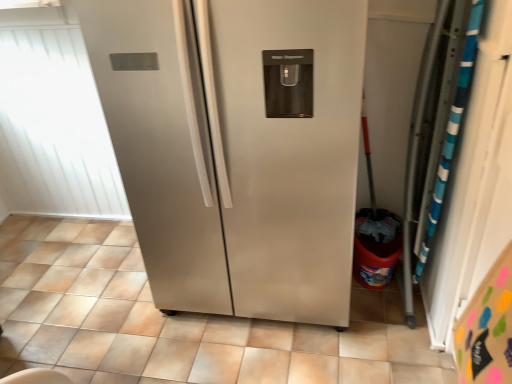
Question: In the image, is white matte window screen at upper left positioned in front of or behind satin silver refrigerator at center?

Choices:
 (A) behind
 (B) front

Answer: (A)

Question: In terms of height, does white matte window screen at upper left look taller or shorter compared to satin silver refrigerator at center?

Choices:
 (A) tall
 (B) short

Answer: (A)

Question: Choose the correct answer: Is white matte window screen at upper left inside satin silver refrigerator at center or outside it?

Choices:
 (A) inside
 (B) outside

Answer: (B)

Question: Is satin silver refrigerator at center inside the boundaries of white matte window screen at upper left, or outside?

Choices:
 (A) outside
 (B) inside

Answer: (A)

Question: Is satin silver refrigerator at center in front of or behind white matte window screen at upper left in the image?

Choices:
 (A) behind
 (B) front

Answer: (B)

Question: From the image's perspective, is satin silver refrigerator at center above or below white matte window screen at upper left?

Choices:
 (A) below
 (B) above

Answer: (A)

Question: Considering the relative positions of satin silver refrigerator at center and white matte window screen at upper left in the image provided, is satin silver refrigerator at center to the left or to the right of white matte window screen at upper left?

Choices:
 (A) right
 (B) left

Answer: (A)